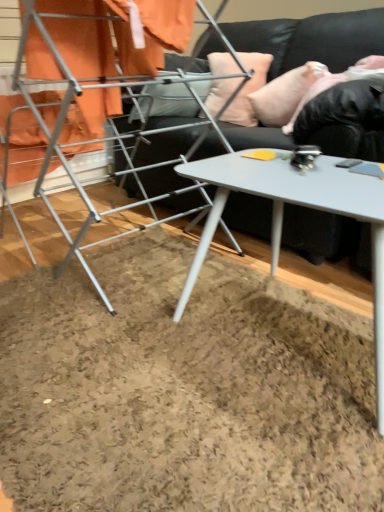
The image size is (384, 512). What do you see at coordinates (315, 94) in the screenshot? I see `black soft fur at upper right` at bounding box center [315, 94].

You are a GUI agent. You are given a task and a screenshot of the screen. Output one action in this format:
    pyautogui.click(x=<x>, y=<y>)
    Task: Click on the black soft fur at upper right
    Image resolution: width=384 pixels, height=512 pixels.
    Given the screenshot: What is the action you would take?
    pyautogui.click(x=315, y=94)

Find the location of a particular element. metallic silver drying rack at left is located at coordinates (69, 102).

Looking at this image, what is the approximate height of white glossy table at center?

18.63 inches.

What do you see at coordinates (285, 94) in the screenshot? The height and width of the screenshot is (512, 384). I see `pink fabric pillow at upper right, marked as the 1th pillow in a right-to-left arrangement` at bounding box center [285, 94].

Image resolution: width=384 pixels, height=512 pixels. Identify the location of black soft fur at upper right. (315, 94).

Is metallic silver drying rack at left at the right side of black soft fur at upper right?

No.

Which is in front, metallic silver drying rack at left or black soft fur at upper right?

metallic silver drying rack at left is in front.

Which is further, (97, 86) or (335, 84)?

The point (335, 84) is farther from the camera.

What's the angular difference between metallic silver drying rack at left and black soft fur at upper right's facing directions?

The angle between the facing direction of metallic silver drying rack at left and the facing direction of black soft fur at upper right is 0.46 degrees.

How different are the orientations of peach fabric pillow at upper center, which is the 1th pillow from left to right, and black soft fur at upper right in degrees?

They differ by 18.7 degrees in their facing directions.

Is peach fabric pillow at upper center, which is the 1th pillow from left to right, to the left or to the right of black soft fur at upper right in the image?

In the image, peach fabric pillow at upper center, which is the 1th pillow from left to right, appears on the left side of black soft fur at upper right.

Is peach fabric pillow at upper center, the 2th pillow from the right, completely or partially outside of black soft fur at upper right?

That's correct, peach fabric pillow at upper center, the 2th pillow from the right, is outside of black soft fur at upper right.

Does point (253, 117) come closer to viewer compared to point (318, 81)?

No.

Considering the relative sizes of pink fabric pillow at upper right, marked as the 1th pillow in a right-to-left arrangement, and white glossy table at center in the image provided, is pink fabric pillow at upper right, marked as the 1th pillow in a right-to-left arrangement, smaller than white glossy table at center?

Yes, pink fabric pillow at upper right, marked as the 1th pillow in a right-to-left arrangement, is smaller than white glossy table at center.

From the picture: Looking at their sizes, would you say pink fabric pillow at upper right, placed as the 2th pillow when sorted from left to right, is wider or thinner than white glossy table at center?

Considering their sizes, pink fabric pillow at upper right, placed as the 2th pillow when sorted from left to right, looks slimmer than white glossy table at center.

Are pink fabric pillow at upper right, placed as the 2th pillow when sorted from left to right, and white glossy table at center making contact?

No.

Is pink fabric pillow at upper right, marked as the 1th pillow in a right-to-left arrangement, facing away from white glossy table at center?

No, pink fabric pillow at upper right, marked as the 1th pillow in a right-to-left arrangement, is not facing away from white glossy table at center.

From the image's perspective, is black leather couch at upper center on metallic silver drying rack at left?

Yes.

The width and height of the screenshot is (384, 512). Find the location of `studio couch lying above the metallic silver drying rack at left (from the image's perspective)`. studio couch lying above the metallic silver drying rack at left (from the image's perspective) is located at coordinates (311, 39).

Based on the photo, is black leather couch at upper center bigger than metallic silver drying rack at left?

Yes, black leather couch at upper center is bigger than metallic silver drying rack at left.

Measure the distance from black leather couch at upper center to metallic silver drying rack at left.

35.19 centimeters.

Can you see metallic silver drying rack at left touching pink fabric pillow at upper right, marked as the 1th pillow in a right-to-left arrangement?

No.

Which object is wider, metallic silver drying rack at left or pink fabric pillow at upper right, marked as the 1th pillow in a right-to-left arrangement?

Wider between the two is metallic silver drying rack at left.

Can we say metallic silver drying rack at left lies outside pink fabric pillow at upper right, marked as the 1th pillow in a right-to-left arrangement?

That's correct, metallic silver drying rack at left is outside of pink fabric pillow at upper right, marked as the 1th pillow in a right-to-left arrangement.

What's the angular difference between metallic silver drying rack at left and pink fabric pillow at upper right, marked as the 1th pillow in a right-to-left arrangement,'s facing directions?

The facing directions of metallic silver drying rack at left and pink fabric pillow at upper right, marked as the 1th pillow in a right-to-left arrangement, are 0.46 degrees apart.

Where is `bunk bed on the left of peach fabric pillow at upper center, the 2th pillow from the right`? The width and height of the screenshot is (384, 512). bunk bed on the left of peach fabric pillow at upper center, the 2th pillow from the right is located at coordinates (69, 102).

Does peach fabric pillow at upper center, which is the 1th pillow from left to right, have a greater height compared to metallic silver drying rack at left?

In fact, peach fabric pillow at upper center, which is the 1th pillow from left to right, may be shorter than metallic silver drying rack at left.

From the image's perspective, is peach fabric pillow at upper center, the 2th pillow from the right, beneath metallic silver drying rack at left?

Actually, peach fabric pillow at upper center, the 2th pillow from the right, appears above metallic silver drying rack at left in the image.

Does peach fabric pillow at upper center, which is the 1th pillow from left to right, come in front of metallic silver drying rack at left?

No.

Where is `the 1st pillow behind the black leather couch at upper center`? Image resolution: width=384 pixels, height=512 pixels. the 1st pillow behind the black leather couch at upper center is located at coordinates (285, 94).

Is point (295, 100) closer to camera compared to point (169, 176)?

Yes, it is.

Between pink fabric pillow at upper right, placed as the 2th pillow when sorted from left to right, and black leather couch at upper center, which one has smaller width?

Thinner between the two is pink fabric pillow at upper right, placed as the 2th pillow when sorted from left to right.

Where is `bunk bed below the black soft fur at upper right (from a real-world perspective)`? This screenshot has height=512, width=384. bunk bed below the black soft fur at upper right (from a real-world perspective) is located at coordinates (69, 102).

At what (x,y) coordinates should I click in order to perform the action: click on person positioned vertically above the peach fabric pillow at upper center, which is the 1th pillow from left to right (from a real-world perspective). Please return your answer as a coordinate pair (x, y). Looking at the image, I should click on (315, 94).

Which object lies nearer to the anchor point black leather couch at upper center, peach fabric pillow at upper center, which is the 1th pillow from left to right, or white glossy table at center?

peach fabric pillow at upper center, which is the 1th pillow from left to right, is closer to black leather couch at upper center.

From the image, which object appears to be nearer to peach fabric pillow at upper center, which is the 1th pillow from left to right, white glossy table at center or black leather couch at upper center?

The object closer to peach fabric pillow at upper center, which is the 1th pillow from left to right, is black leather couch at upper center.

When comparing their distances from peach fabric pillow at upper center, the 2th pillow from the right, does black soft fur at upper right or pink fabric pillow at upper right, placed as the 2th pillow when sorted from left to right, seem further?

black soft fur at upper right is further to peach fabric pillow at upper center, the 2th pillow from the right.

Estimate the real-world distances between objects in this image. Which object is closer to white glossy table at center, black leather couch at upper center or pink fabric pillow at upper right, placed as the 2th pillow when sorted from left to right?

black leather couch at upper center is positioned closer to the anchor white glossy table at center.

From the picture: Considering their positions, is white glossy table at center positioned further to peach fabric pillow at upper center, the 2th pillow from the right, than black soft fur at upper right?

white glossy table at center is further to peach fabric pillow at upper center, the 2th pillow from the right.

Which object lies nearer to the anchor point black soft fur at upper right, peach fabric pillow at upper center, the 2th pillow from the right, or metallic silver drying rack at left?

peach fabric pillow at upper center, the 2th pillow from the right.

Considering their positions, is peach fabric pillow at upper center, the 2th pillow from the right, positioned further to metallic silver drying rack at left than black leather couch at upper center?

peach fabric pillow at upper center, the 2th pillow from the right, lies further to metallic silver drying rack at left than the other object.

From the image, which object appears to be nearer to black soft fur at upper right, pink fabric pillow at upper right, marked as the 1th pillow in a right-to-left arrangement, or peach fabric pillow at upper center, the 2th pillow from the right?

Based on the image, pink fabric pillow at upper right, marked as the 1th pillow in a right-to-left arrangement, appears to be nearer to black soft fur at upper right.

Image resolution: width=384 pixels, height=512 pixels. What are the coordinates of `studio couch situated between metallic silver drying rack at left and white glossy table at center from left to right` in the screenshot? It's located at (311, 39).

Locate an element on the screen. Image resolution: width=384 pixels, height=512 pixels. bunk bed located between white glossy table at center and pink fabric pillow at upper right, marked as the 1th pillow in a right-to-left arrangement, in the depth direction is located at coordinates (69, 102).

Locate an element on the screen. The image size is (384, 512). person between white glossy table at center and pink fabric pillow at upper right, placed as the 2th pillow when sorted from left to right, in the front-back direction is located at coordinates (315, 94).

Find the location of a particular element. studio couch between white glossy table at center and peach fabric pillow at upper center, the 2th pillow from the right, along the z-axis is located at coordinates (311, 39).